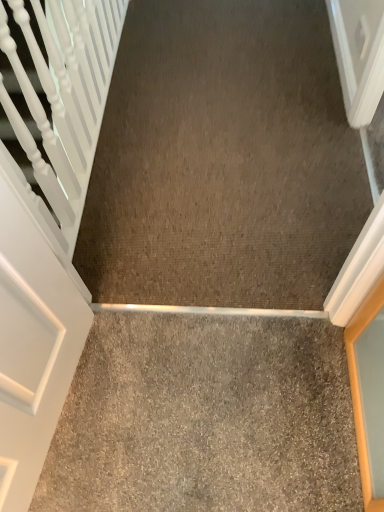
Question: Does gray carpet at center, acting as the second concrete starting from the back, appear on the right side of brown carpet at center, the 1th concrete in the back-to-front sequence?

Choices:
 (A) no
 (B) yes

Answer: (A)

Question: Considering the relative sizes of gray carpet at center, the 1th concrete when ordered from front to back, and brown carpet at center, placed as the first concrete when sorted from top to bottom, in the image provided, is gray carpet at center, the 1th concrete when ordered from front to back, taller than brown carpet at center, placed as the first concrete when sorted from top to bottom,?

Choices:
 (A) yes
 (B) no

Answer: (B)

Question: Is gray carpet at center, the 1th concrete when ordered from front to back, positioned before brown carpet at center, marked as the 2th concrete in a bottom-to-top arrangement?

Choices:
 (A) no
 (B) yes

Answer: (B)

Question: Could you tell me if gray carpet at center, acting as the second concrete starting from the back, is facing brown carpet at center, placed as the first concrete when sorted from top to bottom?

Choices:
 (A) no
 (B) yes

Answer: (B)

Question: From the image's perspective, is gray carpet at center, the 1th concrete when ordered from front to back, under brown carpet at center, placed as the 2th concrete when sorted from front to back?

Choices:
 (A) no
 (B) yes

Answer: (B)

Question: Can you confirm if gray carpet at center, placed as the second concrete when sorted from top to bottom, is positioned to the left of brown carpet at center, marked as the 2th concrete in a bottom-to-top arrangement?

Choices:
 (A) yes
 (B) no

Answer: (A)

Question: Would you say brown carpet at center, placed as the first concrete when sorted from top to bottom, is a long distance from gray carpet at center, placed as the second concrete when sorted from top to bottom?

Choices:
 (A) yes
 (B) no

Answer: (B)

Question: Can you confirm if brown carpet at center, placed as the 2th concrete when sorted from front to back, is taller than gray carpet at center, placed as the second concrete when sorted from top to bottom?

Choices:
 (A) yes
 (B) no

Answer: (A)

Question: Is brown carpet at center, placed as the 2th concrete when sorted from front to back, in contact with gray carpet at center, positioned as the first concrete in bottom-to-top order?

Choices:
 (A) no
 (B) yes

Answer: (A)

Question: Is gray carpet at center, the 1th concrete when ordered from front to back, located within brown carpet at center, placed as the first concrete when sorted from top to bottom?

Choices:
 (A) no
 (B) yes

Answer: (A)

Question: Is the position of brown carpet at center, the 1th concrete in the back-to-front sequence, less distant than that of gray carpet at center, acting as the second concrete starting from the back?

Choices:
 (A) no
 (B) yes

Answer: (A)

Question: Is brown carpet at center, the 1th concrete in the back-to-front sequence, not within gray carpet at center, placed as the second concrete when sorted from top to bottom?

Choices:
 (A) yes
 (B) no

Answer: (A)

Question: Would you say gray carpet at center, acting as the second concrete starting from the back, is inside or outside brown carpet at center, the 1th concrete in the back-to-front sequence?

Choices:
 (A) outside
 (B) inside

Answer: (A)